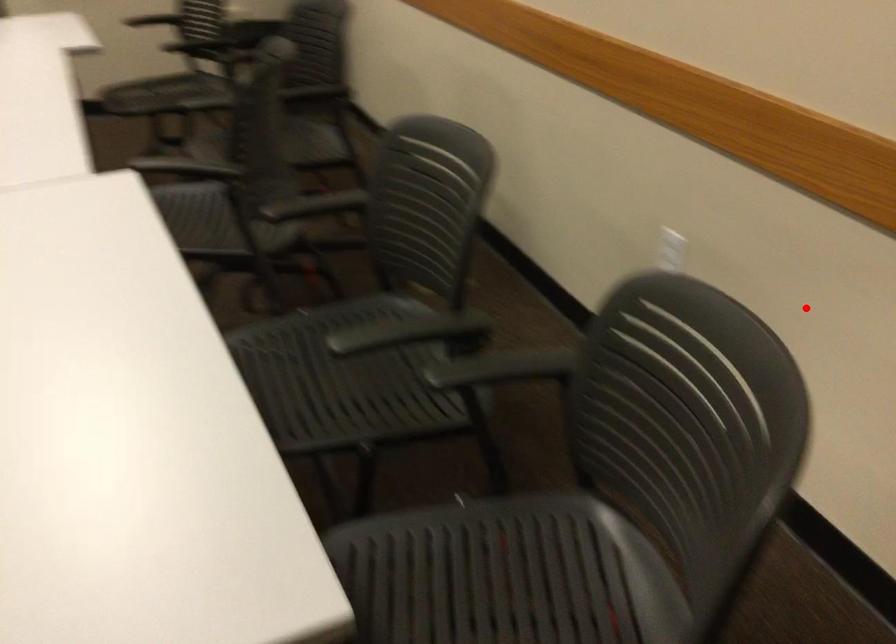
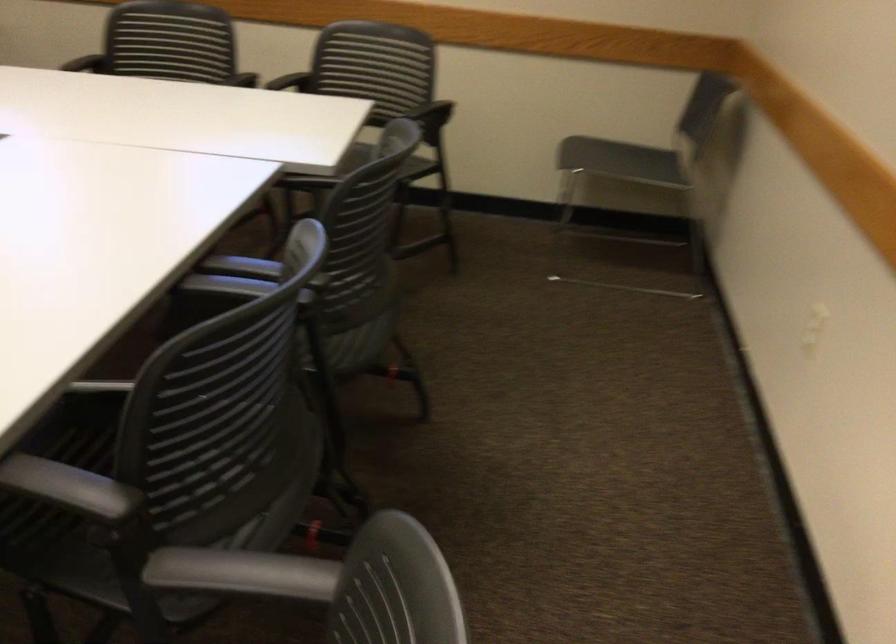
Question: I am providing you with two images of the same scene from different viewpoints. Image1 has a red point marked. In image2, the corresponding 3D location appears at what relative position? Reply with the corresponding letter.

Choices:
 (A) Closer
 (B) Farther

Answer: (B)